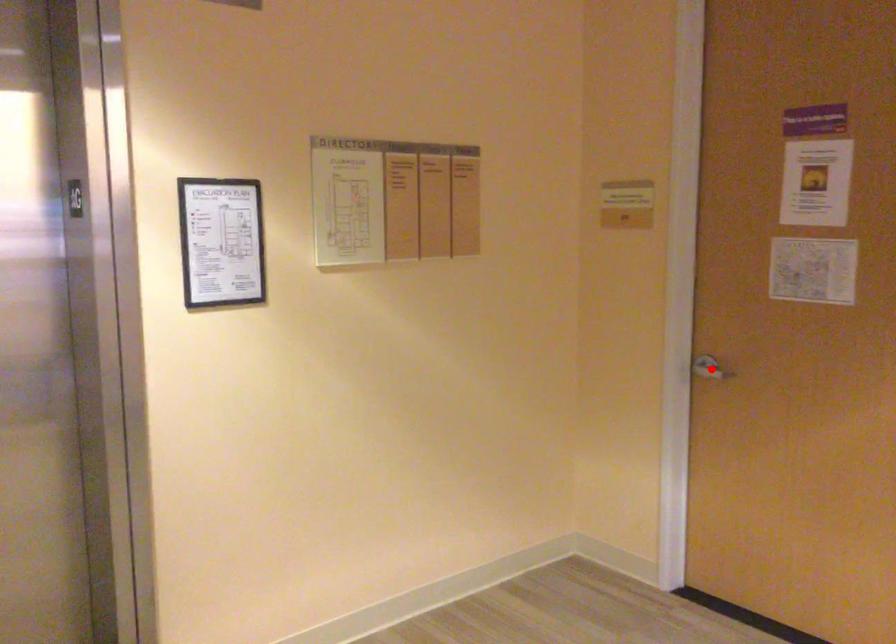
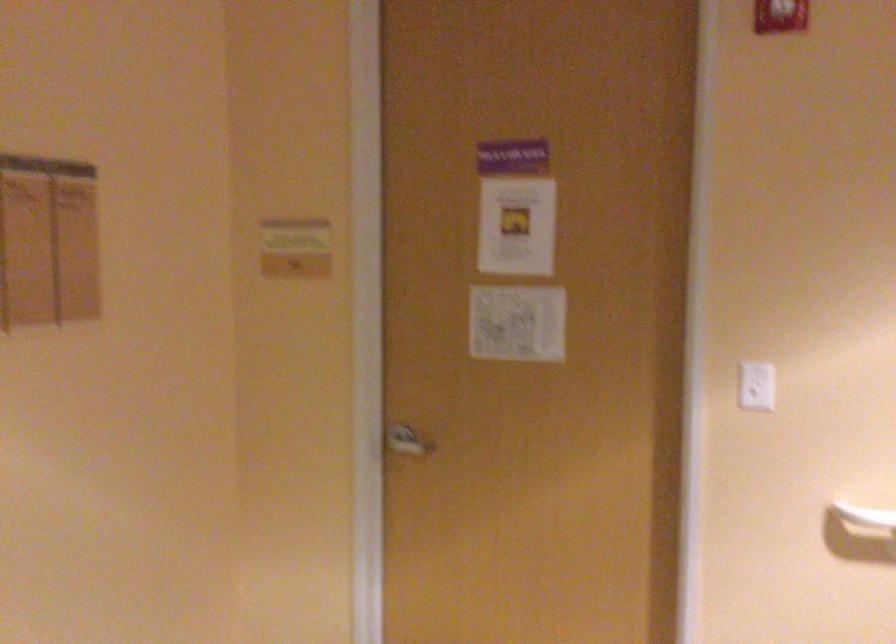
Locate, in the second image, the point that corresponds to the highlighted location in the first image.

(407, 442)